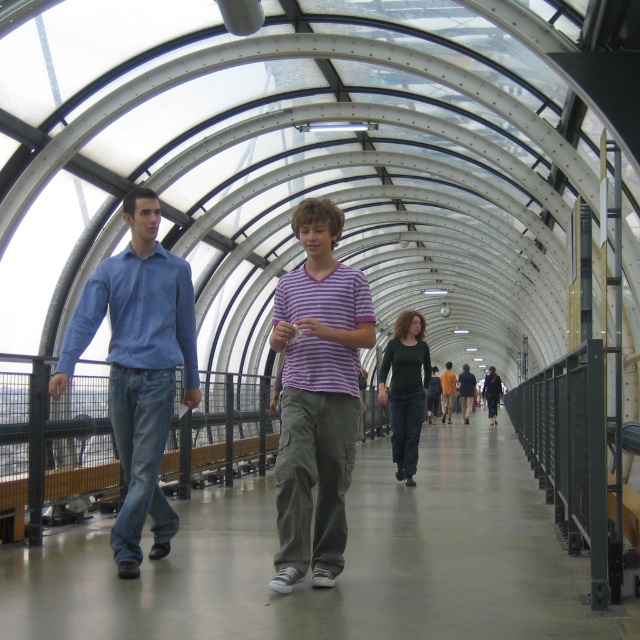
This screenshot has height=640, width=640. I want to click on purple striped shirt at center, so click(316, 396).

Does purple striped shirt at center appear over dark blue jeans at center?

Yes, purple striped shirt at center is above dark blue jeans at center.

The width and height of the screenshot is (640, 640). Identify the location of purple striped shirt at center. (316, 396).

Locate an element on the screen. The image size is (640, 640). purple striped shirt at center is located at coordinates (316, 396).

Which is more to the left, purple striped shirt at center or blue cotton shirt at left?

From the viewer's perspective, blue cotton shirt at left appears more on the left side.

Locate an element on the screen. The image size is (640, 640). purple striped shirt at center is located at coordinates (316, 396).

Can you confirm if purple striped t-shirt at center is positioned to the left of dark green sweater at center?

Indeed, purple striped t-shirt at center is positioned on the left side of dark green sweater at center.

Between purple striped t-shirt at center and dark green sweater at center, which one has less height?

purple striped t-shirt at center is shorter.

Between point (332, 342) and point (392, 388), which one is positioned in front?

Positioned in front is point (332, 342).

This screenshot has width=640, height=640. Find the location of `purple striped t-shirt at center`. purple striped t-shirt at center is located at coordinates (324, 298).